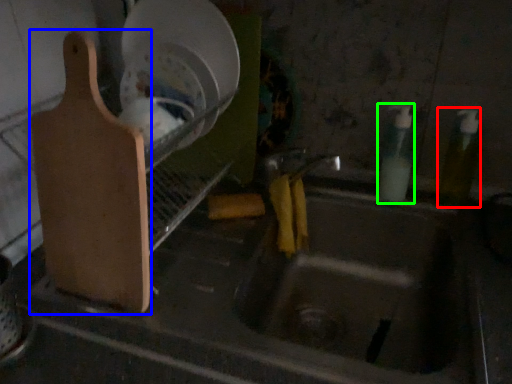
Question: Estimate the real-world distances between objects in this image. Which object is closer to bottle (highlighted by a red box), cutting board (highlighted by a blue box) or bottle (highlighted by a green box)?

Choices:
 (A) cutting board
 (B) bottle

Answer: (B)